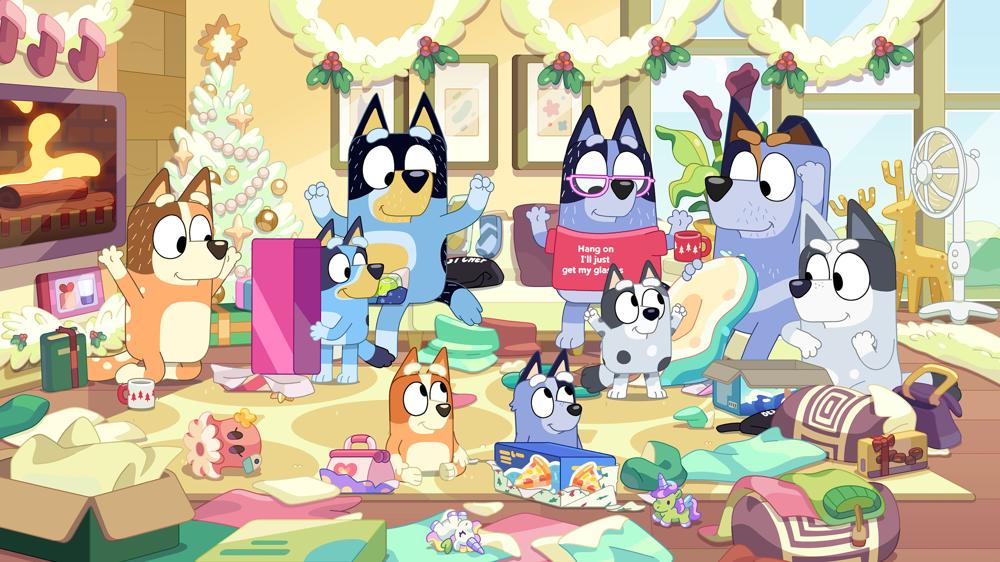
Where is `christmas tree`? christmas tree is located at coordinates (244, 170).